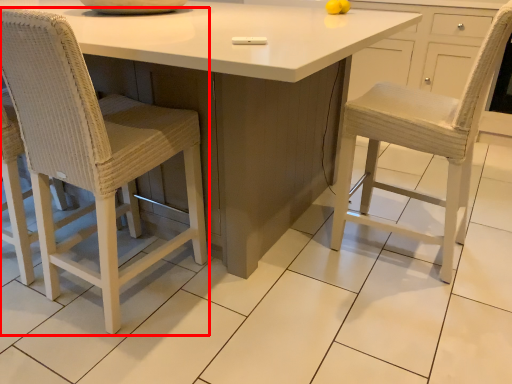
Question: From the image's perspective, where is chair (annotated by the red box) located relative to table?

Choices:
 (A) above
 (B) below

Answer: (B)